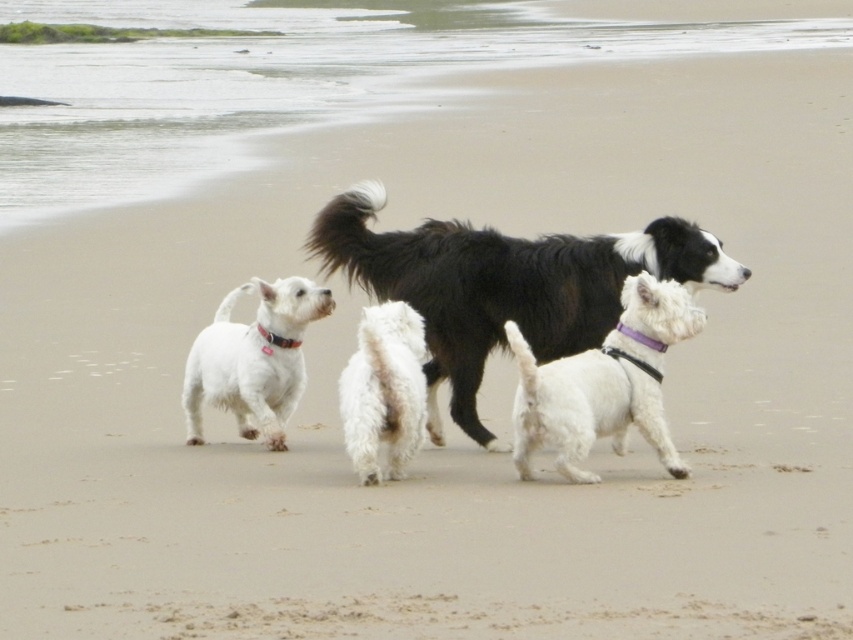
Consider the image. You are a photographer standing at the edge of the beach. You want to take a photo of the white matte dog at center and the white fluffy dog at center. Which dog should you focus on first to ensure both are in focus?

You should focus on the white fluffy dog at center first because it is behind the white matte dog at center, so adjusting focus starting from the back ensures both are in focus.

You are a dog trainer observing the black fluffy dog at center and the white matte dog at center. Which dog would you expect to have a higher center of gravity based on their physical characteristics?

The black fluffy dog at center is much taller than the white matte dog at center, so it likely has a higher center of gravity due to its greater height.